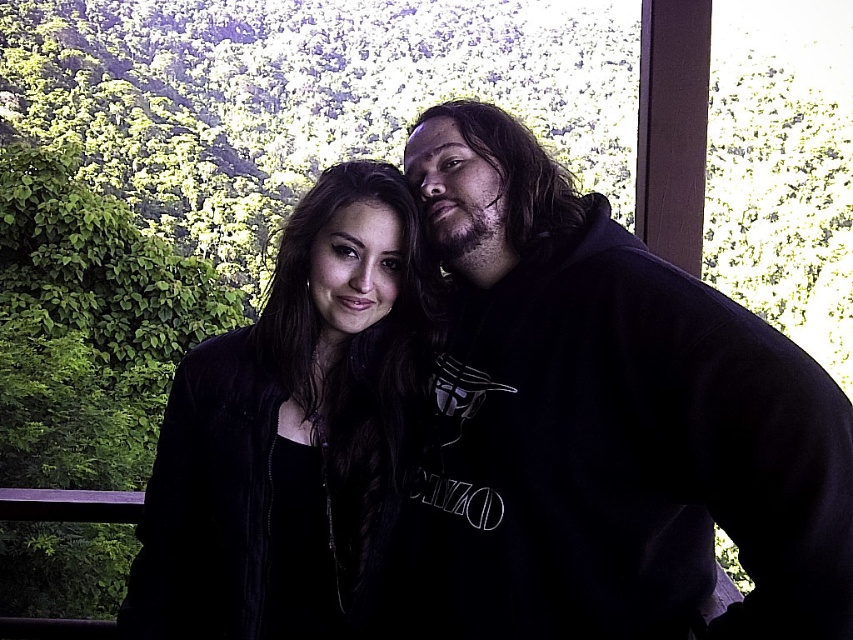
Question: Considering the relative positions of black hoodie at center and black velvet jacket at center in the image provided, where is black hoodie at center located with respect to black velvet jacket at center?

Choices:
 (A) left
 (B) right

Answer: (B)

Question: Does black hoodie at center appear on the left side of black velvet jacket at center?

Choices:
 (A) yes
 (B) no

Answer: (B)

Question: Can you confirm if black hoodie at center is positioned below black velvet jacket at center?

Choices:
 (A) yes
 (B) no

Answer: (B)